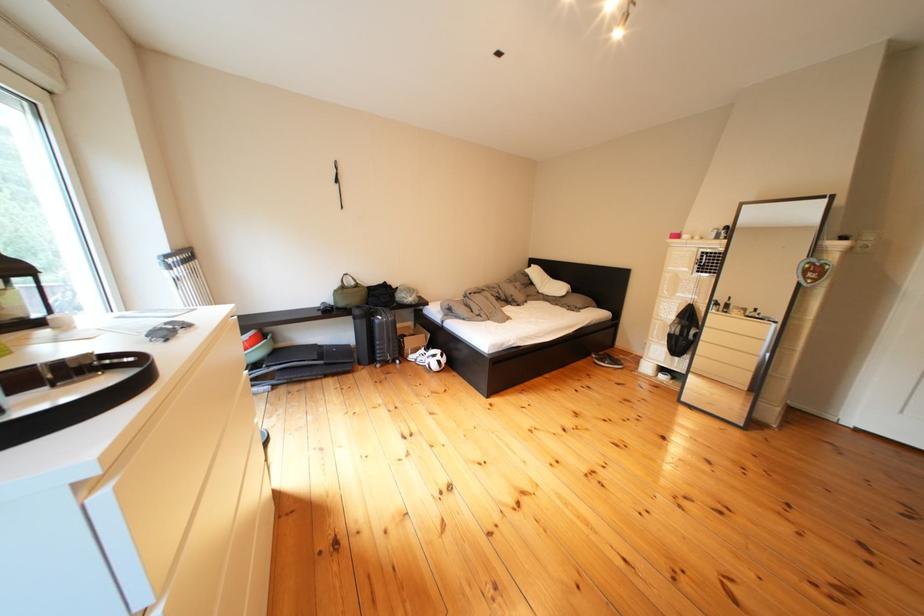
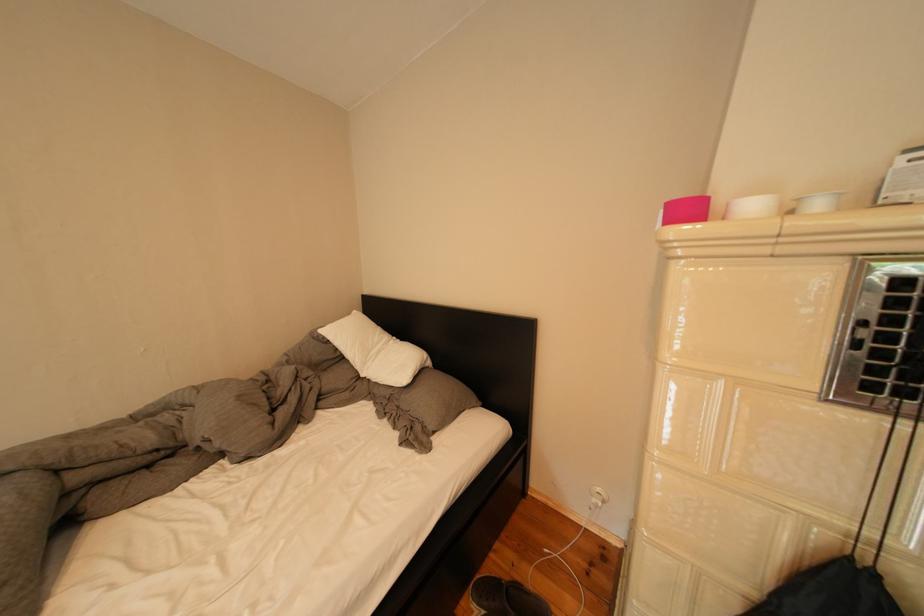
The images are taken continuously from a first-person perspective. In which direction are you moving?

The cameraman moved toward right, forward.